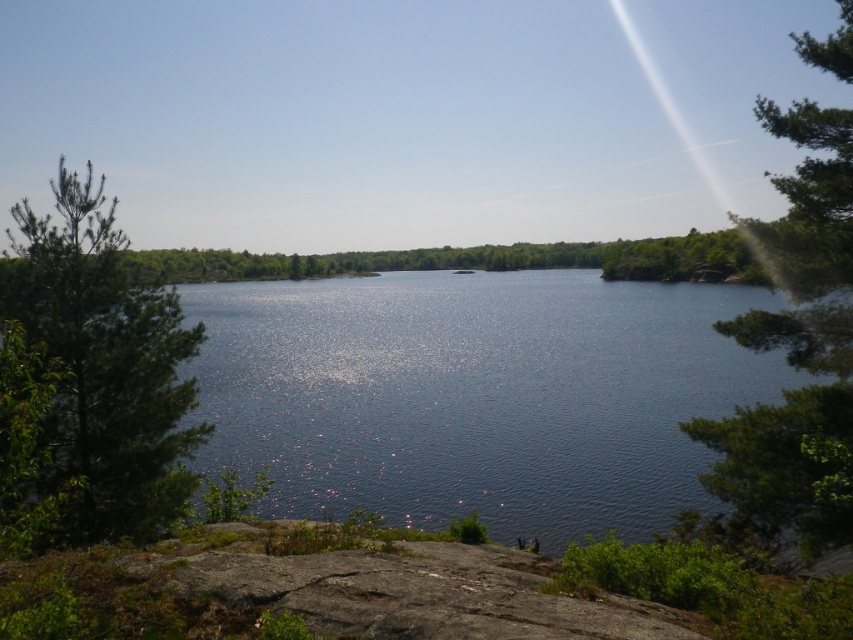
Does shiny blue water at center have a lesser height compared to green needle-like at left?

Incorrect, shiny blue water at center's height does not fall short of green needle-like at left's.

What do you see at coordinates (479, 396) in the screenshot? This screenshot has height=640, width=853. I see `shiny blue water at center` at bounding box center [479, 396].

Locate an element on the screen. The width and height of the screenshot is (853, 640). shiny blue water at center is located at coordinates (479, 396).

Locate an element on the screen. shiny blue water at center is located at coordinates (479, 396).

Based on the photo, which of these two, shiny blue water at center or green leafy tree at right, stands taller?

green leafy tree at right is taller.

Find the location of a particular element. The height and width of the screenshot is (640, 853). shiny blue water at center is located at coordinates (479, 396).

Which is behind, point (622, 381) or point (767, 323)?

The point (622, 381) is behind.

Image resolution: width=853 pixels, height=640 pixels. Identify the location of shiny blue water at center. (479, 396).

Is green needle-like at left closer to the viewer compared to green leafy tree at right?

That is True.

What do you see at coordinates (103, 365) in the screenshot?
I see `green needle-like at left` at bounding box center [103, 365].

Who is more distant from viewer, (x=177, y=332) or (x=834, y=214)?

The point (x=177, y=332) is behind.

I want to click on green needle-like at left, so click(103, 365).